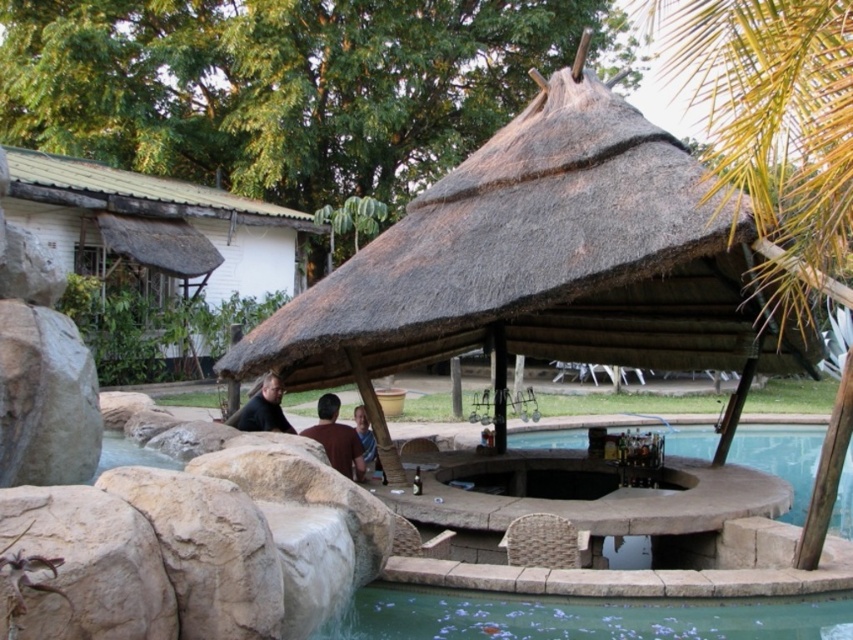
Which is above, thatched roof hut at left or brown leather jacket at center?

Positioned higher is thatched roof hut at left.

Image resolution: width=853 pixels, height=640 pixels. Describe the element at coordinates (154, 260) in the screenshot. I see `thatched roof hut at left` at that location.

Is point (177, 324) more distant than point (354, 460)?

Yes, it is behind point (354, 460).

Identify the location of thatched roof hut at left. (154, 260).

Is thatched roof hut at left further to the viewer compared to clear water at pool bottom?

Yes, it is.

Which of these two, thatched roof hut at left or clear water at pool bottom, stands shorter?

Standing shorter between the two is clear water at pool bottom.

Locate an element on the screen. thatched roof hut at left is located at coordinates (154, 260).

Where is `thatched roof hut at left`? thatched roof hut at left is located at coordinates (154, 260).

Is point (332, 424) positioned before point (366, 211)?

Yes, it is in front of point (366, 211).

Is brown leather chair at center smaller than green leafy palm tree at upper center?

No, brown leather chair at center is not smaller than green leafy palm tree at upper center.

Who is more forward, (360,465) or (340,230)?

Point (360,465) is more forward.

This screenshot has height=640, width=853. I want to click on brown leather chair at center, so click(x=337, y=438).